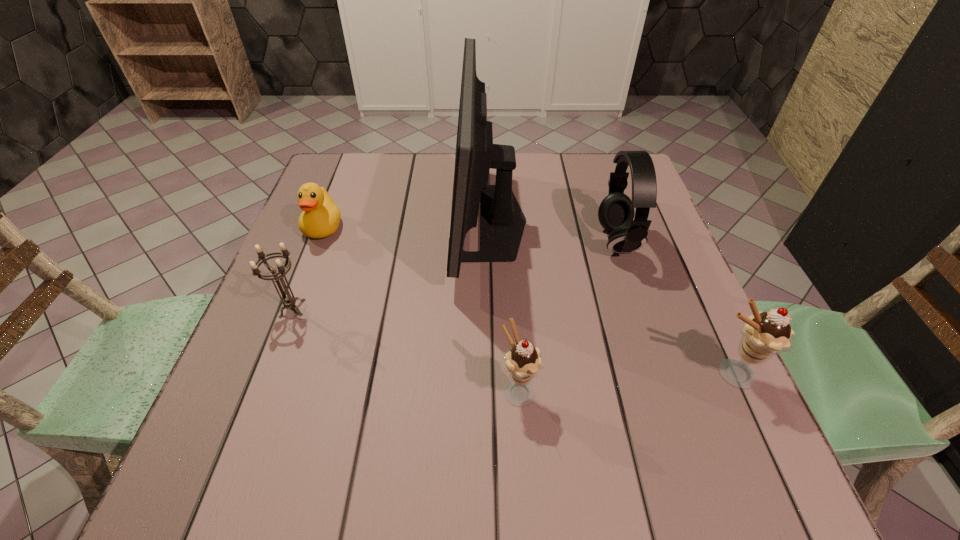
At what (x,y) coordinates should I click in order to perform the action: click on vacant area situated on the screen side of the computer monitor. Please return your answer as a coordinate pair (x, y). The width and height of the screenshot is (960, 540). Looking at the image, I should click on (320, 221).

Locate an element on the screen. The height and width of the screenshot is (540, 960). free spot located 0.060m on the screen side of the computer monitor is located at coordinates (429, 221).

You are a GUI agent. You are given a task and a screenshot of the screen. Output one action in this format:
    pyautogui.click(x=<x>, y=<y>)
    Task: Click on the vacant area situated at the beak of the shortest object
    The height and width of the screenshot is (540, 960).
    Given the screenshot: What is the action you would take?
    pyautogui.click(x=304, y=276)

Image resolution: width=960 pixels, height=540 pixels. I want to click on free location located 0.300m on the back of the third nearest object, so pos(330,211).

At what (x,y) coordinates should I click in order to perform the action: click on free space located on the ear cups of the fifth object from left to right. Please return your answer as a coordinate pair (x, y). Image resolution: width=960 pixels, height=540 pixels. Looking at the image, I should click on (504, 241).

At what (x,y) coordinates should I click in order to perform the action: click on free location located on the ear cups of the fifth object from left to right. Please return your answer as a coordinate pair (x, y). Image resolution: width=960 pixels, height=540 pixels. Looking at the image, I should click on (569, 241).

I want to click on vacant area situated 0.340m on the ear cups of the fifth object from left to right, so click(x=459, y=241).

Identify the location of object at the far edge. (502, 220).

Locate an element on the screen. duck that is at the left edge is located at coordinates (320, 218).

The height and width of the screenshot is (540, 960). I want to click on candle holder that is at the left edge, so click(289, 301).